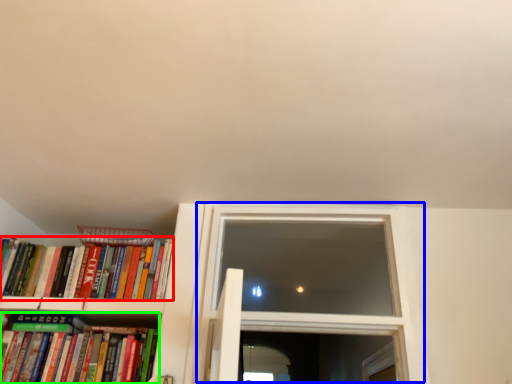
Question: Which object is positioned farthest from book (highlighted by a red box)? Select from window (highlighted by a blue box) and book (highlighted by a green box).

Choices:
 (A) window
 (B) book

Answer: (A)